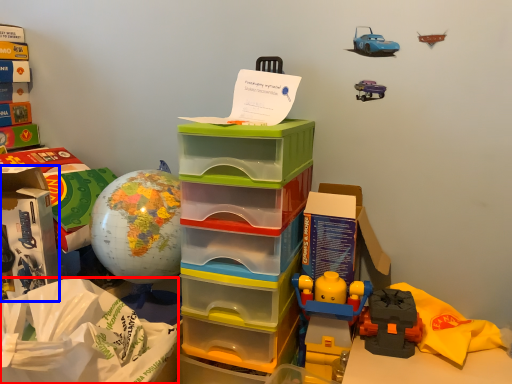
Question: Among these objects, which one is nearest to the camera, paper bag (highlighted by a red box) or storage box (highlighted by a blue box)?

Choices:
 (A) paper bag
 (B) storage box

Answer: (A)